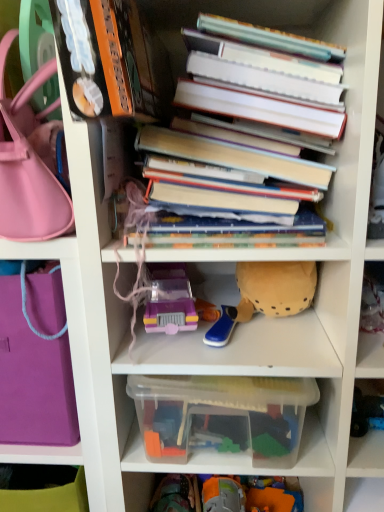
Question: Does point (182, 458) appear closer or farther from the camera than point (31, 404)?

Choices:
 (A) farther
 (B) closer

Answer: (B)

Question: In terms of width, does clear plastic container at center look wider or thinner when compared to purple fabric bag at left, which is the first handbag in bottom-to-top order?

Choices:
 (A) thin
 (B) wide

Answer: (A)

Question: Based on their relative distances, which object is nearer to the blue rubber toy at center, which is counted as the 2th toy, starting from the right?

Choices:
 (A) translucent plastic toy car at center, placed as the 1th toy when sorted from left to right
 (B) soft yellow plush at center, acting as the 1th toy starting from the right
 (C) hardcover books at center
 (D) clear plastic container at center
 (E) purple fabric bag at left, which is the first handbag in bottom-to-top order

Answer: (B)

Question: Which object is the closest to the hardcover books at center?

Choices:
 (A) clear plastic container at center
 (B) purple fabric bag at left, arranged as the second handbag when viewed from the top
 (C) blue rubber toy at center, the 2th toy in the left-to-right sequence
 (D) matte pink handbag at left, which appears as the first handbag when viewed from the top
 (E) translucent plastic toy car at center, positioned as the third toy in right-to-left order

Answer: (D)